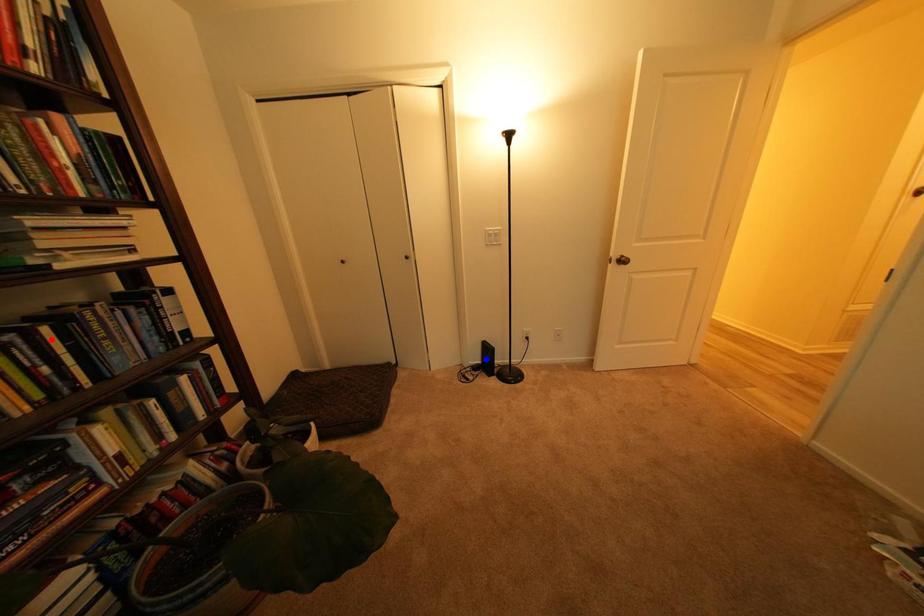
Question: Which of the two points in the image is closer to the camera?

Choices:
 (A) Blue point is closer.
 (B) Red point is closer.

Answer: (B)